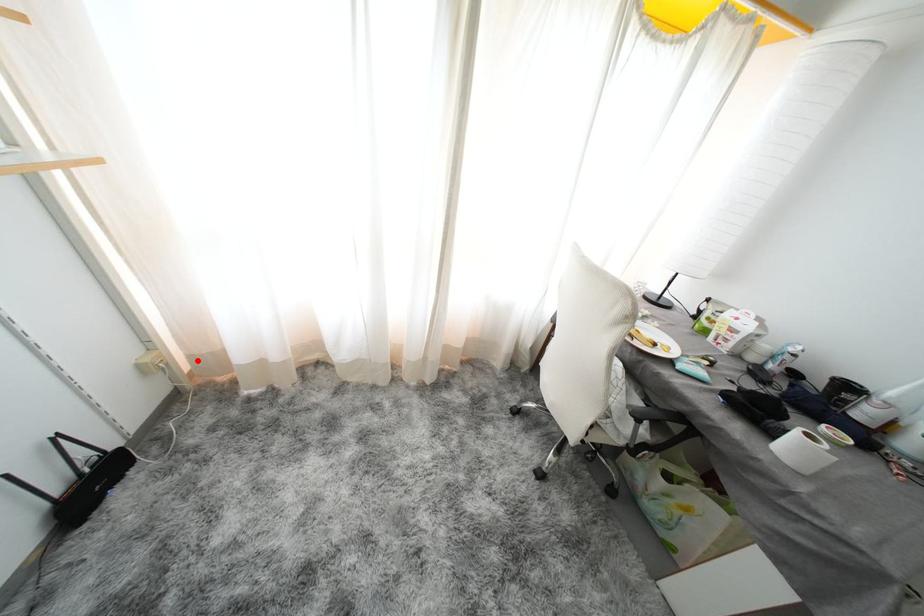
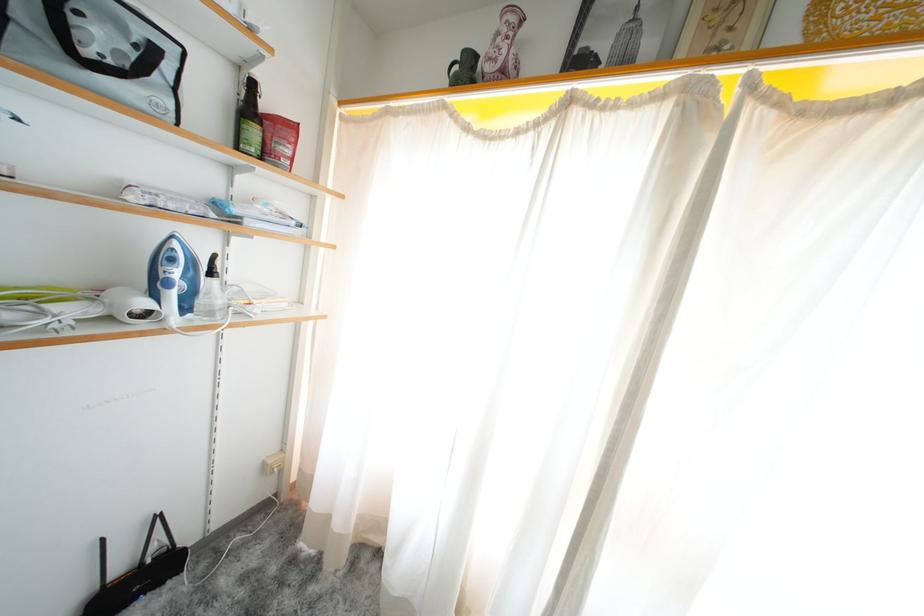
Find the pixel in the second image that matches the highlighted location in the first image.

(306, 475)